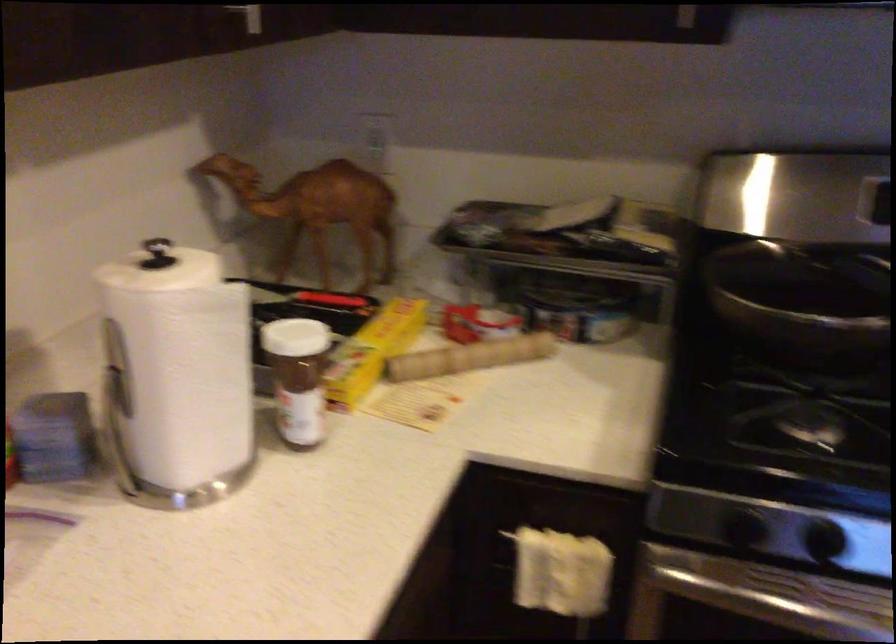
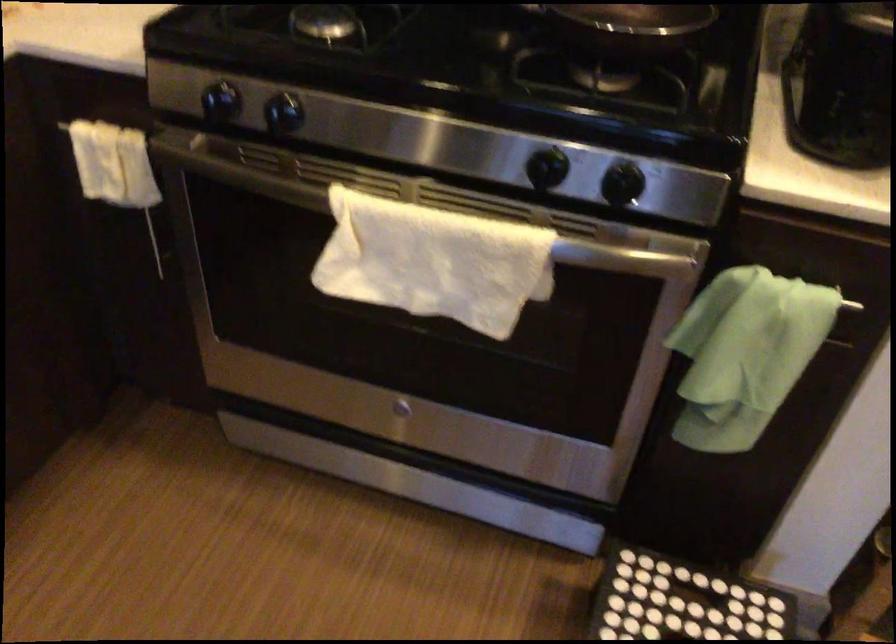
Question: Which direction would the cameraman need to move to produce the second image? Reply with the corresponding letter.

Choices:
 (A) Left
 (B) Right
 (C) Forward
 (D) Backward

Answer: (B)